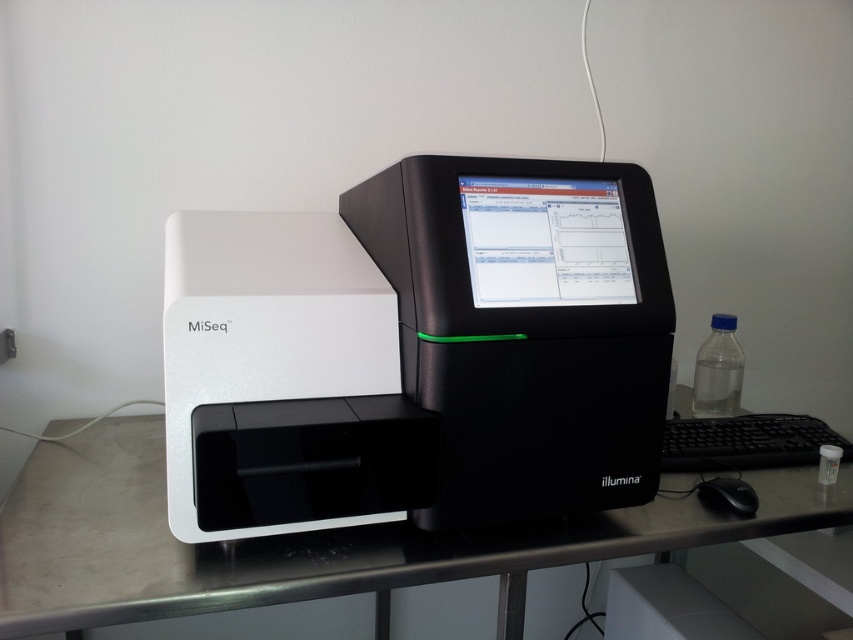
Question: Which object is farther from the camera taking this photo?

Choices:
 (A) black plastic keyboard at lower right
 (B) white plastic printer at center
 (C) black plastic mouse at lower right
 (D) metallic silver computer desk at center

Answer: (C)

Question: Considering the relative positions of matte black monitor at center and black plastic mouse at lower right in the image provided, where is matte black monitor at center located with respect to black plastic mouse at lower right?

Choices:
 (A) above
 (B) below

Answer: (A)

Question: Which point is closer to the camera taking this photo?

Choices:
 (A) (775, 458)
 (B) (529, 493)
 (C) (743, 360)

Answer: (B)

Question: From the image, what is the correct spatial relationship of matte black monitor at center in relation to black plastic mouse at lower right?

Choices:
 (A) left
 (B) right

Answer: (A)

Question: Can you confirm if matte black monitor at center is bigger than black plastic keyboard at lower right?

Choices:
 (A) yes
 (B) no

Answer: (B)

Question: Which point is farther to the camera?

Choices:
 (A) matte black monitor at center
 (B) metallic silver computer desk at center
 (C) transparent plastic bottle at right
 (D) black plastic mouse at lower right

Answer: (C)